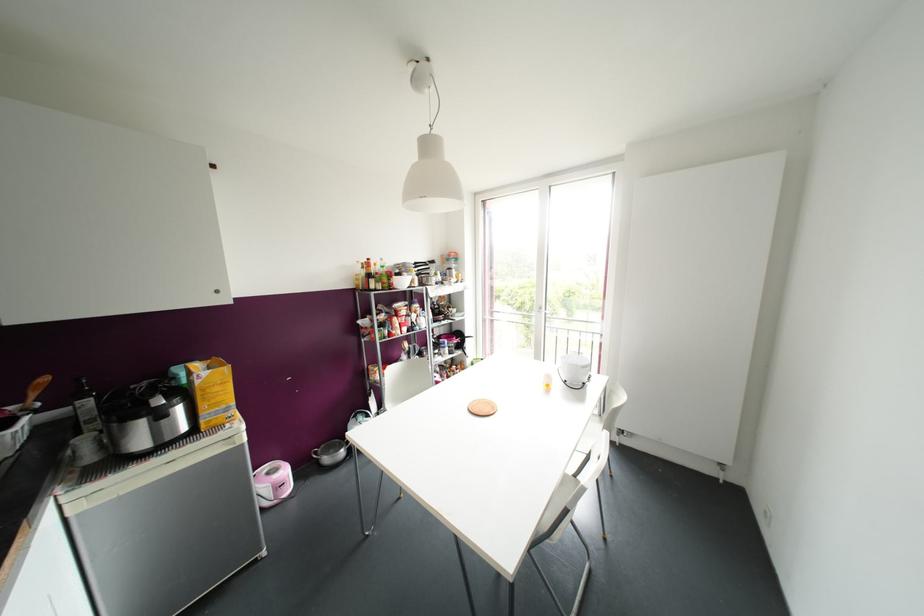
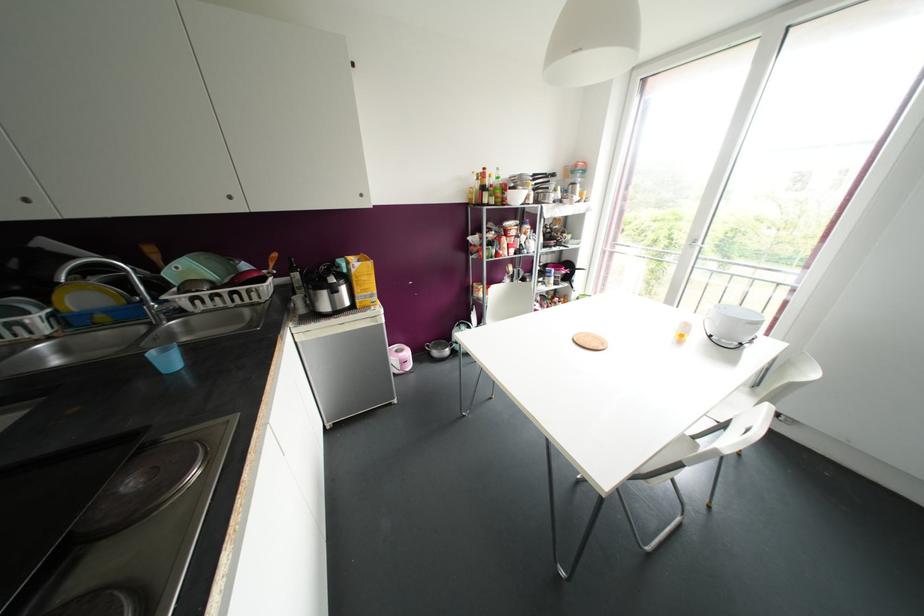
The first image is from the beginning of the video and the second image is from the end. How did the camera likely rotate when shooting the video?

The camera's rotation is toward left-down.